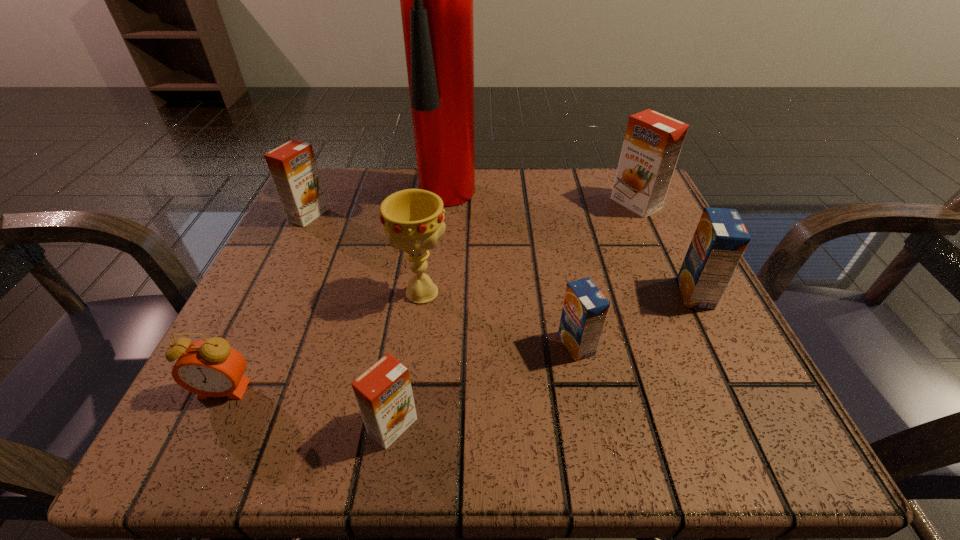
Identify the location of vacant space in between the leftmost orange juice and the second nearest object. (266, 302).

At what (x,y) coordinates should I click in order to perform the action: click on vacant area that lies between the fourth farthest orange juice and the chalice. Please return your answer as a coordinate pair (x, y). The height and width of the screenshot is (540, 960). Looking at the image, I should click on (499, 319).

I want to click on free space between the chalice and the smaller blue orange_juice, so click(x=499, y=319).

This screenshot has height=540, width=960. Find the location of `vacant point located between the chalice and the second smallest orange orange juice`. vacant point located between the chalice and the second smallest orange orange juice is located at coordinates (365, 254).

Where is `empty space that is in between the red fire extinguisher and the third object from right to left`? empty space that is in between the red fire extinguisher and the third object from right to left is located at coordinates (520, 271).

Where is `vacant space in between the farther blue orange_juice and the seventh farthest object`? This screenshot has width=960, height=540. vacant space in between the farther blue orange_juice and the seventh farthest object is located at coordinates (460, 341).

Identify the location of object that is the fourth closest to the third nearest object. 436,0.

Identify which object is the fifth nearest to the biggest orange orange juice. Please provide its 2D coordinates. Your answer should be formatted as a tuple, i.e. [(x, y)], where the tuple contains the x and y coordinates of a point satisfying the conditions above.

[(384, 395)]

The image size is (960, 540). Find the location of `orange juice that is the fourth closest to the nearer blue orange_juice`. orange juice that is the fourth closest to the nearer blue orange_juice is located at coordinates (293, 168).

Select which orange juice appears as the second closest to the right blue orange_juice. Please provide its 2D coordinates. Your answer should be formatted as a tuple, i.e. [(x, y)], where the tuple contains the x and y coordinates of a point satisfying the conditions above.

[(652, 143)]